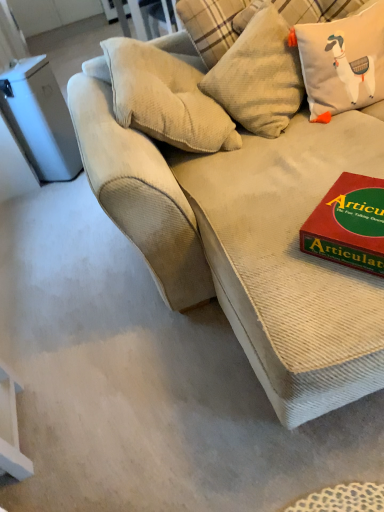
At what (x,y) coordinates should I click in order to perform the action: click on textured beige pillow at upper center, the 2th pillow when ordered from right to left. Please return your answer as a coordinate pair (x, y). The image size is (384, 512). Looking at the image, I should click on (259, 76).

What do you see at coordinates (342, 62) in the screenshot?
I see `beige textured cushion at upper right, which is the 2th pillow from left to right` at bounding box center [342, 62].

What are the coordinates of `textured beige pillow at upper center, the 2th pillow when ordered from right to left` in the screenshot? It's located at (259, 76).

Could you tell me if beige corduroy couch at center is facing textured beige pillow at upper center, which is the first pillow from left to right?

Yes, beige corduroy couch at center faces towards textured beige pillow at upper center, which is the first pillow from left to right.

Can you confirm if beige corduroy couch at center is taller than textured beige pillow at upper center, the 2th pillow when ordered from right to left?

Yes.

Does beige corduroy couch at center appear on the right side of textured beige pillow at upper center, the 2th pillow when ordered from right to left?

Yes.

Is red cardboard game at right oriented towards beige textured cushion at upper right, positioned as the first pillow in right-to-left order?

No, red cardboard game at right is not aimed at beige textured cushion at upper right, positioned as the first pillow in right-to-left order.

From a real-world perspective, which object rests below the other?

In real-world perspective, red cardboard game at right is lower.

Considering the positions of objects red cardboard game at right and beige textured cushion at upper right, which is the 2th pillow from left to right, in the image provided, who is more to the left, red cardboard game at right or beige textured cushion at upper right, which is the 2th pillow from left to right,?

Positioned to the left is red cardboard game at right.

This screenshot has width=384, height=512. In order to click on pillow that is the 1st object located above the red cardboard game at right (from the image's perspective) in this screenshot , I will do `click(342, 62)`.

From their relative heights in the image, would you say textured beige pillow at upper center, which is the first pillow from left to right, is taller or shorter than beige corduroy couch at center?

textured beige pillow at upper center, which is the first pillow from left to right, is shorter than beige corduroy couch at center.

Is textured beige pillow at upper center, the 2th pillow when ordered from right to left, beside beige corduroy couch at center?

There is a gap between textured beige pillow at upper center, the 2th pillow when ordered from right to left, and beige corduroy couch at center.

Find the location of a particular element. This screenshot has height=512, width=384. pillow lying on the left of beige corduroy couch at center is located at coordinates [x=259, y=76].

From the image's perspective, which object appears higher, textured beige pillow at upper center, the 2th pillow when ordered from right to left, or beige corduroy couch at center?

textured beige pillow at upper center, the 2th pillow when ordered from right to left.

From a real-world perspective, who is located higher, red cardboard game at right or textured beige pillow at upper center, which is the first pillow from left to right?

From a 3D spatial view, textured beige pillow at upper center, which is the first pillow from left to right, is above.

Which of these two, red cardboard game at right or textured beige pillow at upper center, the 2th pillow when ordered from right to left, is thinner?

Thinner between the two is textured beige pillow at upper center, the 2th pillow when ordered from right to left.

Between red cardboard game at right and textured beige pillow at upper center, which is the first pillow from left to right, which one has smaller size?

red cardboard game at right is smaller.

Find the location of a particular element. The width and height of the screenshot is (384, 512). the 2nd pillow behind the red cardboard game at right, starting your count from the anchor is located at coordinates [x=259, y=76].

Does beige corduroy couch at center appear on the left side of beige textured cushion at upper right, which is the 2th pillow from left to right?

Yes, beige corduroy couch at center is to the left of beige textured cushion at upper right, which is the 2th pillow from left to right.

Based on the photo, from a real-world perspective, is beige corduroy couch at center positioned above or below beige textured cushion at upper right, which is the 2th pillow from left to right?

In terms of real-world spatial position, beige corduroy couch at center is below beige textured cushion at upper right, which is the 2th pillow from left to right.

Can you confirm if beige corduroy couch at center is thinner than beige textured cushion at upper right, positioned as the first pillow in right-to-left order?

No.

Which of these two, beige corduroy couch at center or beige textured cushion at upper right, positioned as the first pillow in right-to-left order, is bigger?

beige corduroy couch at center.

Measure the distance between beige textured cushion at upper right, positioned as the first pillow in right-to-left order, and textured beige pillow at upper center, the 2th pillow when ordered from right to left.

beige textured cushion at upper right, positioned as the first pillow in right-to-left order, and textured beige pillow at upper center, the 2th pillow when ordered from right to left, are 6.45 inches apart.

From the image's perspective, between beige textured cushion at upper right, positioned as the first pillow in right-to-left order, and textured beige pillow at upper center, which is the first pillow from left to right, who is located below?

From the image's view, beige textured cushion at upper right, positioned as the first pillow in right-to-left order, is below.

Where is `pillow directly beneath the beige textured cushion at upper right, positioned as the first pillow in right-to-left order (from a real-world perspective)`? This screenshot has height=512, width=384. pillow directly beneath the beige textured cushion at upper right, positioned as the first pillow in right-to-left order (from a real-world perspective) is located at coordinates (259, 76).

Can you confirm if beige textured cushion at upper right, which is the 2th pillow from left to right, is shorter than red cardboard game at right?

No.

From a real-world perspective, does beige textured cushion at upper right, which is the 2th pillow from left to right, sit lower than red cardboard game at right?

Actually, beige textured cushion at upper right, which is the 2th pillow from left to right, is physically above red cardboard game at right in the real world.

Which is more to the right, beige textured cushion at upper right, which is the 2th pillow from left to right, or red cardboard game at right?

beige textured cushion at upper right, which is the 2th pillow from left to right.

From the image's perspective, is beige textured cushion at upper right, which is the 2th pillow from left to right, located above red cardboard game at right?

Yes.

Identify the location of studio couch in front of the textured beige pillow at upper center, which is the first pillow from left to right. The height and width of the screenshot is (512, 384). (248, 241).

Locate an element on the screen. paperback book below the beige textured cushion at upper right, which is the 2th pillow from left to right (from the image's perspective) is located at coordinates (349, 224).

Looking at the image, which one is located further to red cardboard game at right, beige corduroy couch at center or beige textured cushion at upper right, positioned as the first pillow in right-to-left order?

beige textured cushion at upper right, positioned as the first pillow in right-to-left order, is further to red cardboard game at right.

Looking at the image, which one is located further to beige textured cushion at upper right, which is the 2th pillow from left to right, textured beige pillow at upper center, which is the first pillow from left to right, or beige corduroy couch at center?

beige corduroy couch at center lies further to beige textured cushion at upper right, which is the 2th pillow from left to right, than the other object.

Estimate the real-world distances between objects in this image. Which object is closer to beige textured cushion at upper right, positioned as the first pillow in right-to-left order, red cardboard game at right or textured beige pillow at upper center, the 2th pillow when ordered from right to left?

Based on the image, textured beige pillow at upper center, the 2th pillow when ordered from right to left, appears to be nearer to beige textured cushion at upper right, positioned as the first pillow in right-to-left order.

When comparing their distances from red cardboard game at right, does textured beige pillow at upper center, which is the first pillow from left to right, or beige textured cushion at upper right, which is the 2th pillow from left to right, seem further?

textured beige pillow at upper center, which is the first pillow from left to right, is further to red cardboard game at right.

When comparing their distances from textured beige pillow at upper center, which is the first pillow from left to right, does red cardboard game at right or beige corduroy couch at center seem closer?

beige corduroy couch at center is closer to textured beige pillow at upper center, which is the first pillow from left to right.

Considering their positions, is beige textured cushion at upper right, positioned as the first pillow in right-to-left order, positioned closer to beige corduroy couch at center than red cardboard game at right?

The object closer to beige corduroy couch at center is red cardboard game at right.

When comparing their distances from beige corduroy couch at center, does beige textured cushion at upper right, which is the 2th pillow from left to right, or textured beige pillow at upper center, which is the first pillow from left to right, seem closer?

textured beige pillow at upper center, which is the first pillow from left to right.

Which object lies further to the anchor point beige textured cushion at upper right, positioned as the first pillow in right-to-left order, textured beige pillow at upper center, the 2th pillow when ordered from right to left, or red cardboard game at right?

red cardboard game at right is positioned further to the anchor beige textured cushion at upper right, positioned as the first pillow in right-to-left order.

I want to click on paperback book between beige corduroy couch at center and beige textured cushion at upper right, which is the 2th pillow from left to right, from front to back, so click(349, 224).

Where is `pillow between textured beige pillow at upper center, which is the first pillow from left to right, and red cardboard game at right, in the vertical direction`? The image size is (384, 512). pillow between textured beige pillow at upper center, which is the first pillow from left to right, and red cardboard game at right, in the vertical direction is located at coordinates (342, 62).

The image size is (384, 512). In order to click on paperback book located between beige corduroy couch at center and textured beige pillow at upper center, the 2th pillow when ordered from right to left, in the depth direction in this screenshot , I will do `click(349, 224)`.

Find the location of a particular element. This screenshot has height=512, width=384. pillow located between beige corduroy couch at center and textured beige pillow at upper center, the 2th pillow when ordered from right to left, in the depth direction is located at coordinates (342, 62).